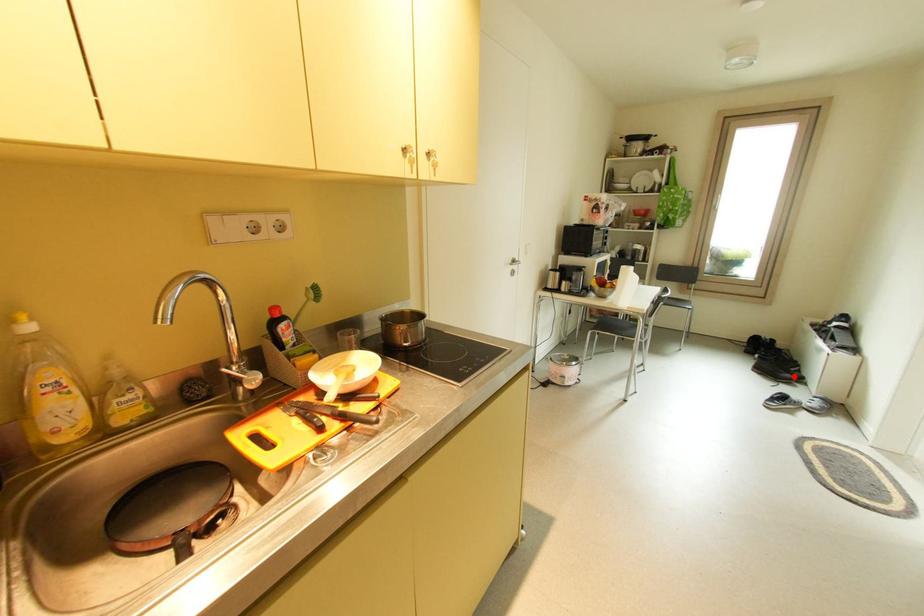
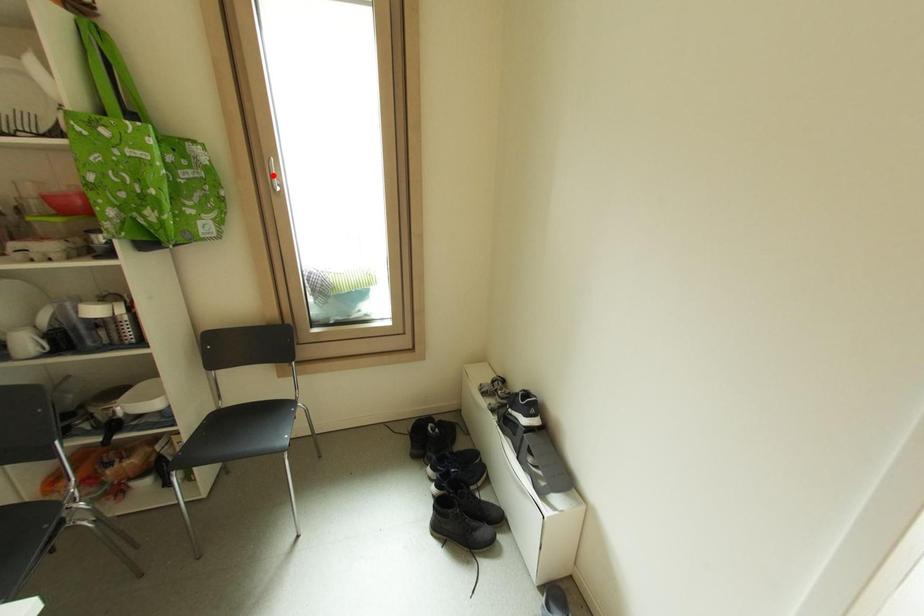
I am providing you with two images of the same scene from different viewpoints. A red point is marked on the first image and another point is marked on the second image. Does the point marked in image1 correspond to the same location as the one in image2?

No